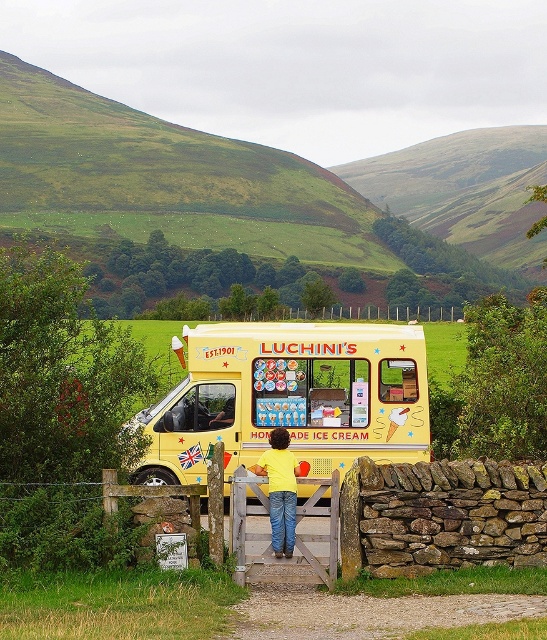
Is point (71, 164) in front of point (261, 465)?

No, it is not.

How much distance is there between green grassy hillside at upper left and yellow matte shirt at center?

green grassy hillside at upper left and yellow matte shirt at center are 88.29 meters apart from each other.

Is point (53, 177) more distant than point (288, 540)?

Yes, point (53, 177) is behind point (288, 540).

The height and width of the screenshot is (640, 547). What are the coordinates of `green grassy hillside at upper left` in the screenshot? It's located at (195, 198).

Is yellow matte ice cream van at center to the right of wooden gate at center from the viewer's perspective?

Incorrect, yellow matte ice cream van at center is not on the right side of wooden gate at center.

Which of these two, yellow matte ice cream van at center or wooden gate at center, stands taller?

yellow matte ice cream van at center

What do you see at coordinates (289, 397) in the screenshot? I see `yellow matte ice cream van at center` at bounding box center [289, 397].

This screenshot has height=640, width=547. I want to click on yellow matte ice cream van at center, so [289, 397].

Which is in front, point (193, 212) or point (223, 310)?

Point (223, 310) is in front.

Does green grassy hillside at upper left have a smaller size compared to wooden gate at center?

Actually, green grassy hillside at upper left might be larger than wooden gate at center.

The height and width of the screenshot is (640, 547). In order to click on green grassy hillside at upper left in this screenshot , I will do `click(195, 198)`.